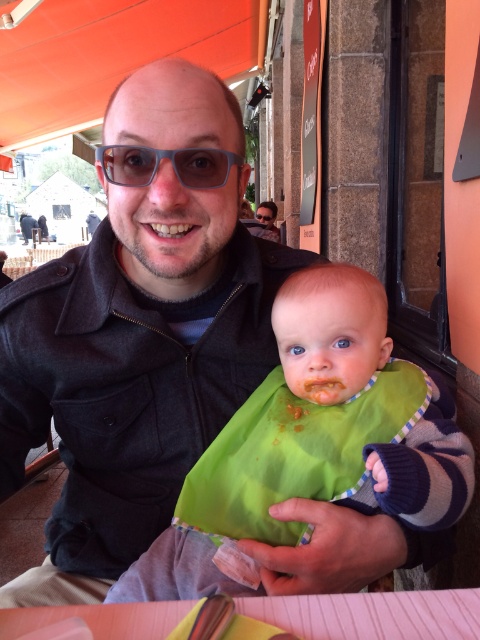
Which is more to the left, pink paper at lower center or matte black jacket at center?

matte black jacket at center

The image size is (480, 640). What do you see at coordinates (372, 614) in the screenshot?
I see `pink paper at lower center` at bounding box center [372, 614].

Locate an element on the screen. Image resolution: width=480 pixels, height=640 pixels. pink paper at lower center is located at coordinates pyautogui.click(x=372, y=614).

Can you confirm if transparent plastic goggles at center is smaller than matte black jacket at center?

Yes.

Does transparent plastic goggles at center appear on the left side of matte black jacket at center?

No, transparent plastic goggles at center is not to the left of matte black jacket at center.

Measure the distance between transparent plastic goggles at center and camera.

transparent plastic goggles at center is 24.60 inches from camera.

Find the location of a particular element. transparent plastic goggles at center is located at coordinates (170, 161).

Between point (83, 605) and point (132, 170), which one is positioned in front?

Point (83, 605) is more forward.

Is point (420, 620) positioned behind point (175, 154)?

No, (420, 620) is closer to viewer.

Identify the location of pink paper at lower center. (372, 614).